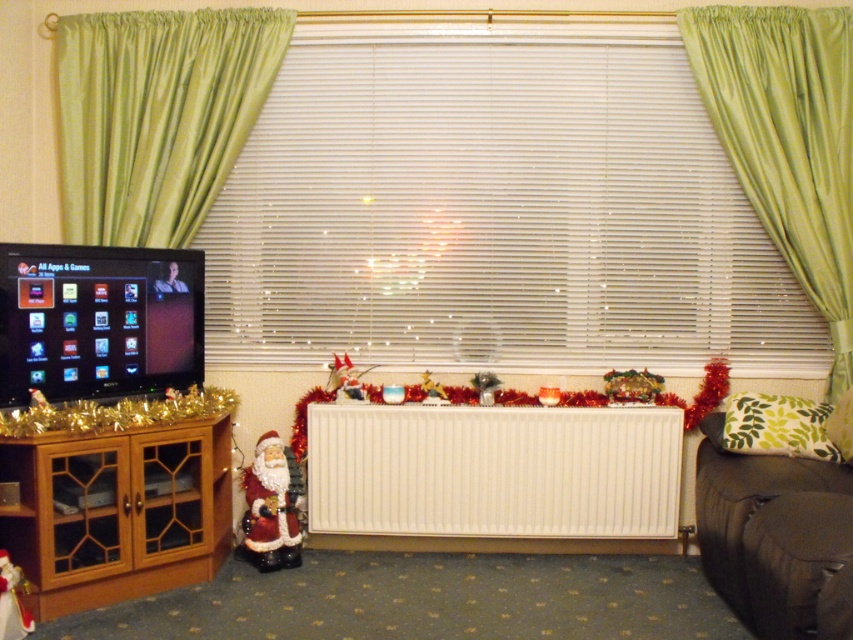
Question: Which point is closer to the camera?

Choices:
 (A) green satin curtain at upper left
 (B) wooden cabinet at left
 (C) shiny metallic tinsel at center

Answer: (B)

Question: Is white matte radiator at center positioned at the back of green silk curtain at right?

Choices:
 (A) no
 (B) yes

Answer: (B)

Question: Among these objects, which one is farthest from the camera?

Choices:
 (A) white matte radiator at center
 (B) green satin curtain at upper left
 (C) wooden cabinet at left
 (D) green silk curtain at right

Answer: (B)

Question: Where is white plastic blinds at center located in relation to green silk curtain at right in the image?

Choices:
 (A) right
 (B) left

Answer: (B)

Question: Can you confirm if white plastic blinds at center is thinner than white matte radiator at center?

Choices:
 (A) no
 (B) yes

Answer: (A)

Question: Which object is positioned closest to the dark brown leather couch at lower right?

Choices:
 (A) green silk curtain at right
 (B) white matte radiator at center

Answer: (B)